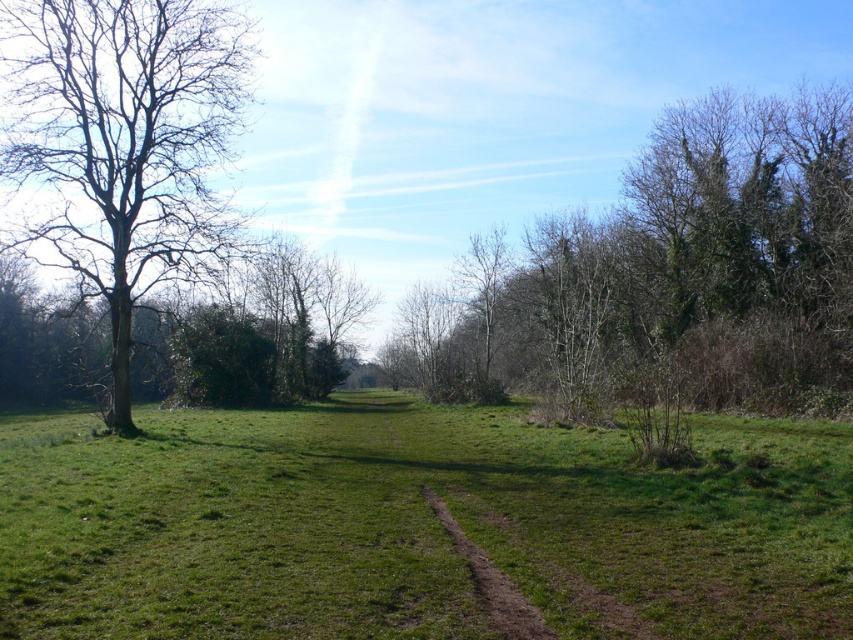
Question: Which object appears farthest from the camera in this image?

Choices:
 (A) bare branches at upper right
 (B) bare wood tree at left

Answer: (A)

Question: Can you confirm if green grass at center is positioned to the left of bare wood tree at left?

Choices:
 (A) no
 (B) yes

Answer: (A)

Question: Is bare branches at upper right below bare wood tree at left?

Choices:
 (A) no
 (B) yes

Answer: (B)

Question: Which object appears farthest from the camera in this image?

Choices:
 (A) bare wood tree at left
 (B) green grass at center
 (C) bare branches at upper right

Answer: (C)

Question: Among these objects, which one is nearest to the camera?

Choices:
 (A) bare branches at upper right
 (B) green grass at center
 (C) bare wood tree at left

Answer: (B)

Question: Does green grass at center appear on the right side of bare branches at upper right?

Choices:
 (A) no
 (B) yes

Answer: (A)